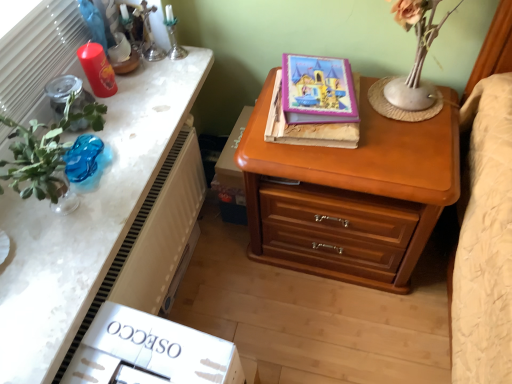
Image resolution: width=512 pixels, height=384 pixels. In order to click on free spot to the right of hardcover book at center, which is the 1th book from bottom to top in this screenshot , I will do `click(404, 115)`.